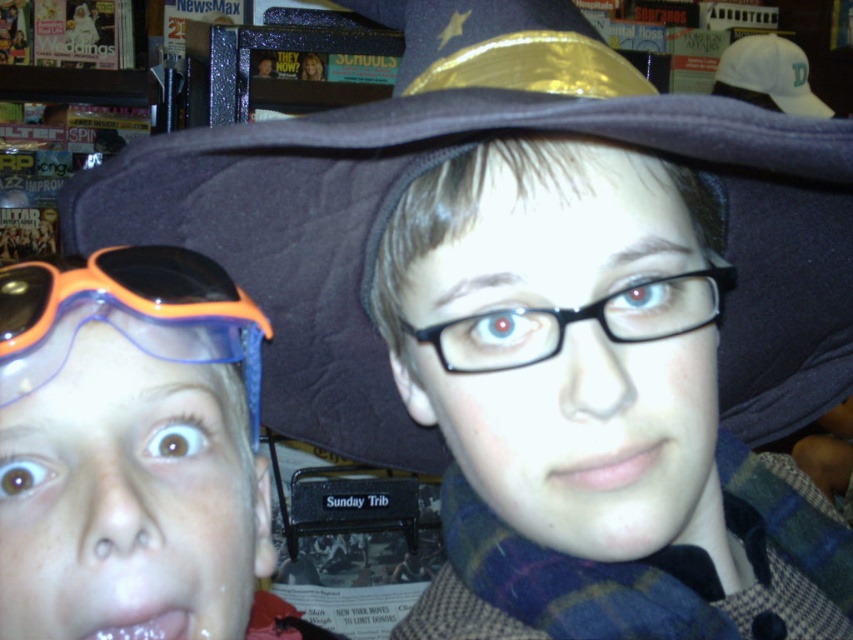
Can you confirm if dark felt witch hat at upper center is positioned to the left of black plastic glasses at center?

Indeed, dark felt witch hat at upper center is positioned on the left side of black plastic glasses at center.

Can you confirm if dark felt witch hat at upper center is bigger than black plastic glasses at center?

Yes.

You are a GUI agent. You are given a task and a screenshot of the screen. Output one action in this format:
    pyautogui.click(x=<x>, y=<y>)
    Task: Click on the dark felt witch hat at upper center
    The image size is (853, 640).
    Given the screenshot: What is the action you would take?
    pyautogui.click(x=451, y=156)

Identify the location of dark felt witch hat at upper center. (451, 156).